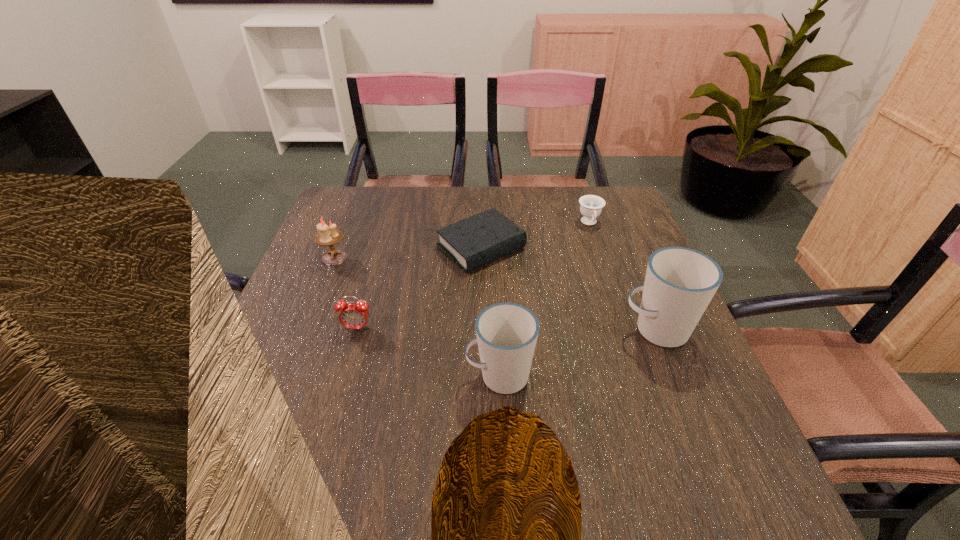
You are a GUI agent. You are given a task and a screenshot of the screen. Output one action in this format:
    pyautogui.click(x=<x>, y=<y>)
    Task: Click on the free space for a new cup on the left
    The width and height of the screenshot is (960, 540).
    Given the screenshot: What is the action you would take?
    pyautogui.click(x=306, y=433)